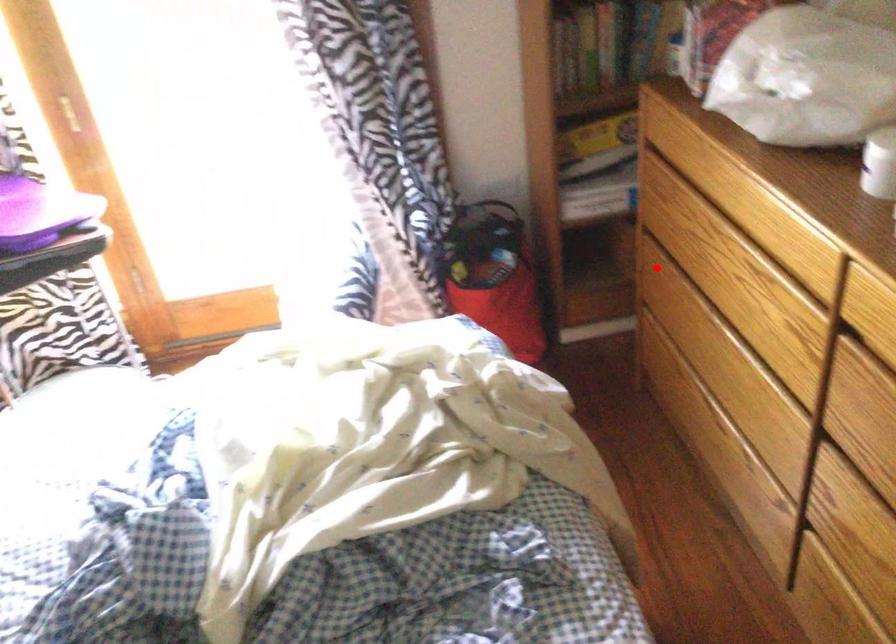
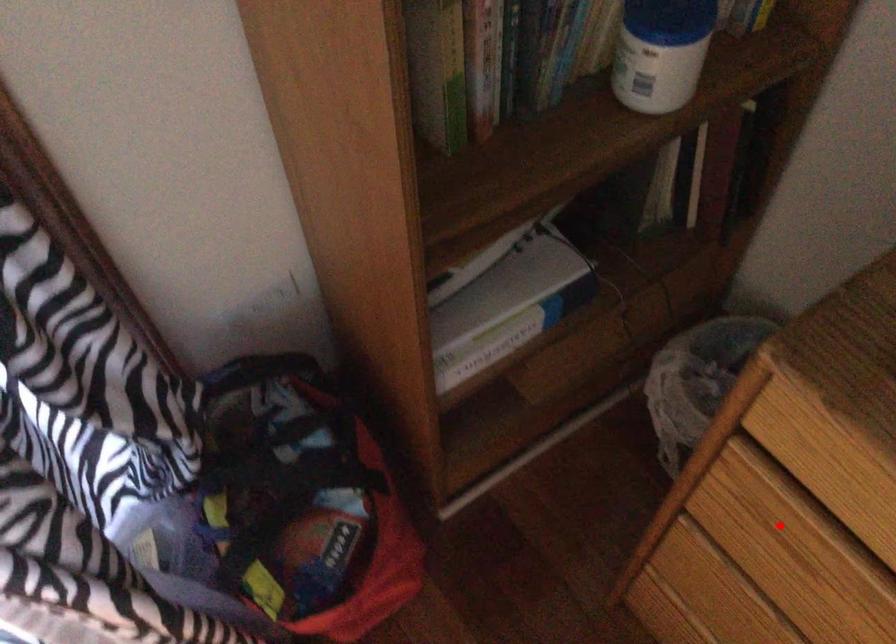
I am providing you with two images of the same scene from different viewpoints. A red point is marked on the first image and another point is marked on the second image. Do the highlighted points in image1 and image2 indicate the same real-world spot?

No